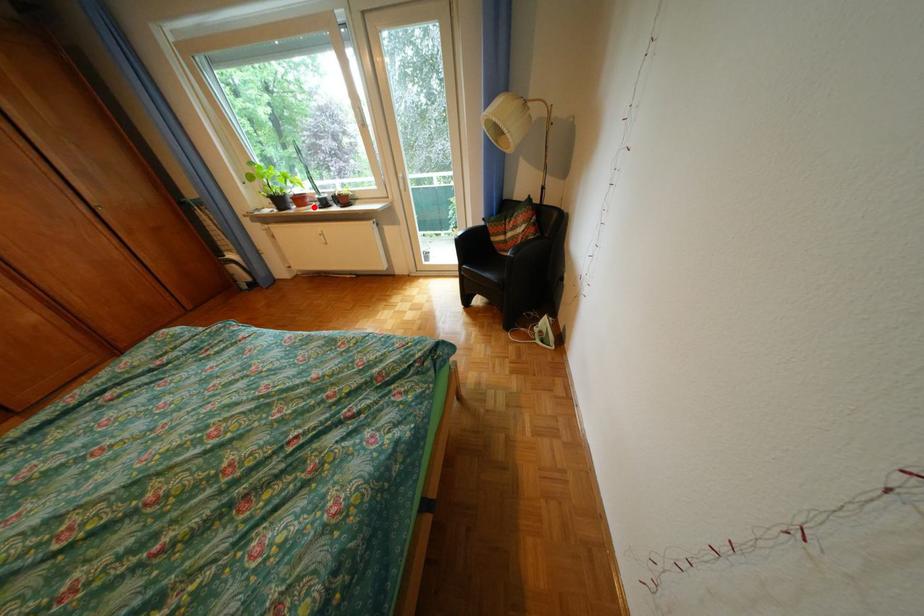
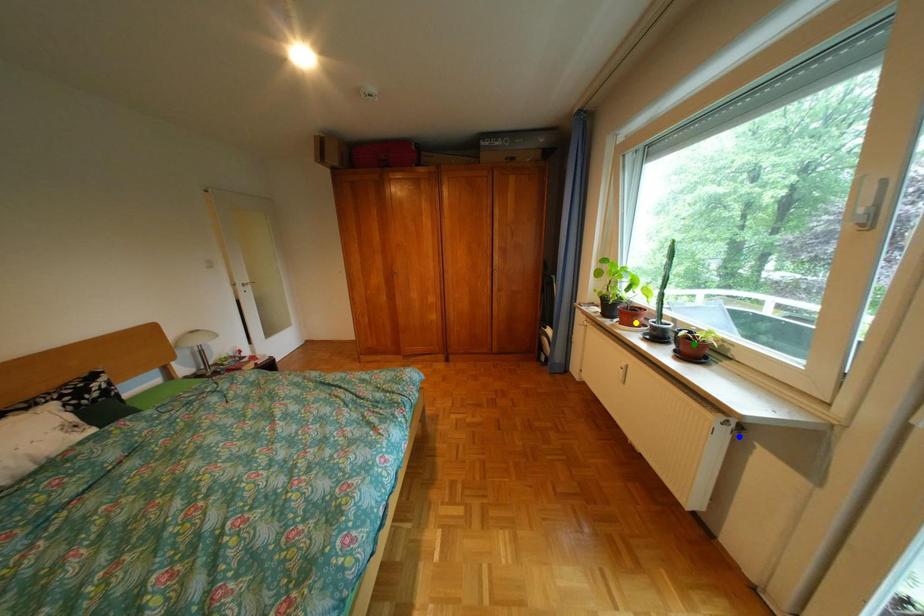
Question: I am providing you with two images of the same scene from different viewpoints. A red point is marked on the first image. You are given multiple points on the second image. Can you choose the point in image 2 that corresponds to the point in image 1?

Choices:
 (A) blue point
 (B) green point
 (C) yellow point

Answer: (C)